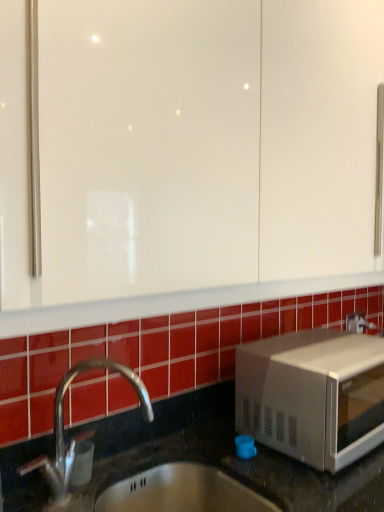
What is the approximate width of clear plastic soap dispenser at lower left?

clear plastic soap dispenser at lower left is 3.28 inches in width.

This screenshot has width=384, height=512. I want to click on clear plastic soap dispenser at lower left, so click(x=82, y=463).

Measure the distance between point (79, 461) and camera.

Point (79, 461) is 3.40 feet away from camera.

Describe the element at coordinates (82, 463) in the screenshot. I see `clear plastic soap dispenser at lower left` at that location.

The height and width of the screenshot is (512, 384). Describe the element at coordinates (312, 395) in the screenshot. I see `white matte microwave at lower right` at that location.

At what (x,y) coordinates should I click in order to perform the action: click on white matte microwave at lower right. Please return your answer as a coordinate pair (x, y). Image resolution: width=384 pixels, height=512 pixels. Looking at the image, I should click on (312, 395).

The image size is (384, 512). Find the location of `clear plastic soap dispenser at lower left`. clear plastic soap dispenser at lower left is located at coordinates (x=82, y=463).

Considering the positions of objects white matte microwave at lower right and clear plastic soap dispenser at lower left in the image provided, who is more to the right, white matte microwave at lower right or clear plastic soap dispenser at lower left?

Positioned to the right is white matte microwave at lower right.

Considering the positions of objects white matte microwave at lower right and clear plastic soap dispenser at lower left in the image provided, who is in front, white matte microwave at lower right or clear plastic soap dispenser at lower left?

clear plastic soap dispenser at lower left is closer to the camera.

Which is in front, point (336, 367) or point (80, 465)?

The point (80, 465) is closer to the camera.

From the image's perspective, which one is positioned higher, white matte microwave at lower right or clear plastic soap dispenser at lower left?

white matte microwave at lower right.

Consider the image. From a real-world perspective, is white matte microwave at lower right positioned under clear plastic soap dispenser at lower left based on gravity?

No, from a real-world perspective, white matte microwave at lower right is not below clear plastic soap dispenser at lower left.

Which of these two, white matte microwave at lower right or clear plastic soap dispenser at lower left, is thinner?

Thinner between the two is clear plastic soap dispenser at lower left.

Between white matte microwave at lower right and clear plastic soap dispenser at lower left, which one has more height?

white matte microwave at lower right.

Looking at the image, does white matte microwave at lower right seem bigger or smaller compared to clear plastic soap dispenser at lower left?

white matte microwave at lower right is bigger than clear plastic soap dispenser at lower left.

Is white matte microwave at lower right not inside clear plastic soap dispenser at lower left?

Absolutely, white matte microwave at lower right is external to clear plastic soap dispenser at lower left.

Is white matte microwave at lower right not near clear plastic soap dispenser at lower left?

No, white matte microwave at lower right is in close proximity to clear plastic soap dispenser at lower left.

Is white matte microwave at lower right aimed at clear plastic soap dispenser at lower left?

No, white matte microwave at lower right is not oriented towards clear plastic soap dispenser at lower left.

Can you tell me how much white matte microwave at lower right and clear plastic soap dispenser at lower left differ in facing direction?

There is a 0.00666-degree angle between the facing directions of white matte microwave at lower right and clear plastic soap dispenser at lower left.

I want to click on microwave oven lying on the right of clear plastic soap dispenser at lower left, so click(312, 395).

Considering the relative positions of clear plastic soap dispenser at lower left and white matte microwave at lower right in the image provided, is clear plastic soap dispenser at lower left to the right of white matte microwave at lower right from the viewer's perspective?

No.

Which object is further away from the camera taking this photo, clear plastic soap dispenser at lower left or white matte microwave at lower right?

Positioned behind is white matte microwave at lower right.

Is point (91, 474) less distant than point (333, 469)?

No, it is not.

From the image's perspective, between clear plastic soap dispenser at lower left and white matte microwave at lower right, which one is located above?

From the image's view, white matte microwave at lower right is above.

From a real-world perspective, who is located higher, clear plastic soap dispenser at lower left or white matte microwave at lower right?

white matte microwave at lower right is physically above.

Between clear plastic soap dispenser at lower left and white matte microwave at lower right, which one has larger width?

Wider between the two is white matte microwave at lower right.

Is clear plastic soap dispenser at lower left shorter than white matte microwave at lower right?

Correct, clear plastic soap dispenser at lower left is not as tall as white matte microwave at lower right.

In the scene shown: Is clear plastic soap dispenser at lower left bigger or smaller than white matte microwave at lower right?

Considering their sizes, clear plastic soap dispenser at lower left takes up less space than white matte microwave at lower right.

Is clear plastic soap dispenser at lower left not inside white matte microwave at lower right?

Absolutely, clear plastic soap dispenser at lower left is external to white matte microwave at lower right.

Is clear plastic soap dispenser at lower left far away from white matte microwave at lower right?

clear plastic soap dispenser at lower left is actually quite close to white matte microwave at lower right.

Does clear plastic soap dispenser at lower left turn towards white matte microwave at lower right?

No, clear plastic soap dispenser at lower left does not turn towards white matte microwave at lower right.

What's the angular difference between clear plastic soap dispenser at lower left and white matte microwave at lower right's facing directions?

The facing directions of clear plastic soap dispenser at lower left and white matte microwave at lower right are 0.00666 degrees apart.

Find the location of a particular element. This screenshot has width=384, height=512. soap dispenser below the white matte microwave at lower right (from a real-world perspective) is located at coordinates (82, 463).

Identify the location of microwave oven that appears behind the clear plastic soap dispenser at lower left. (312, 395).

Find the location of a particular element. This screenshot has width=384, height=512. microwave oven located above the clear plastic soap dispenser at lower left (from a real-world perspective) is located at coordinates (312, 395).